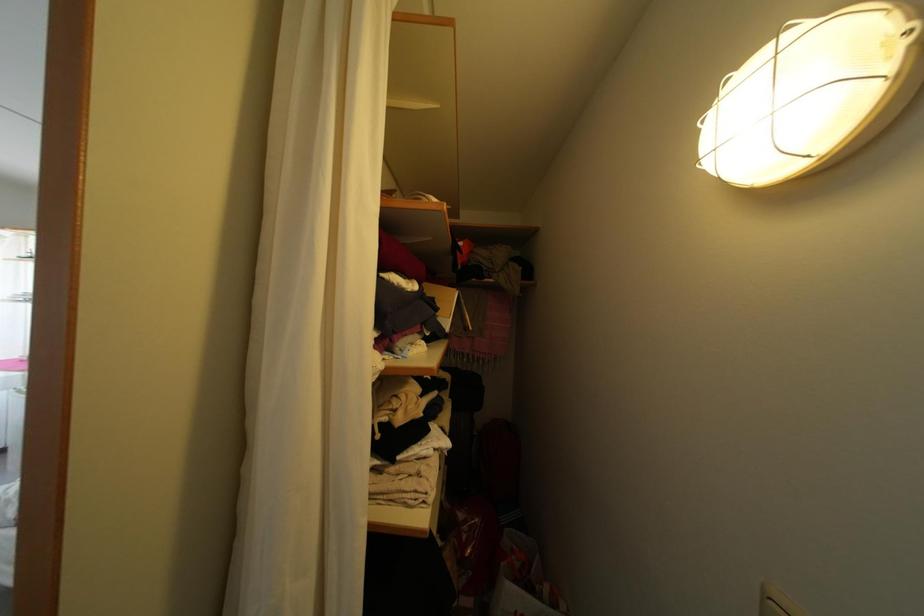
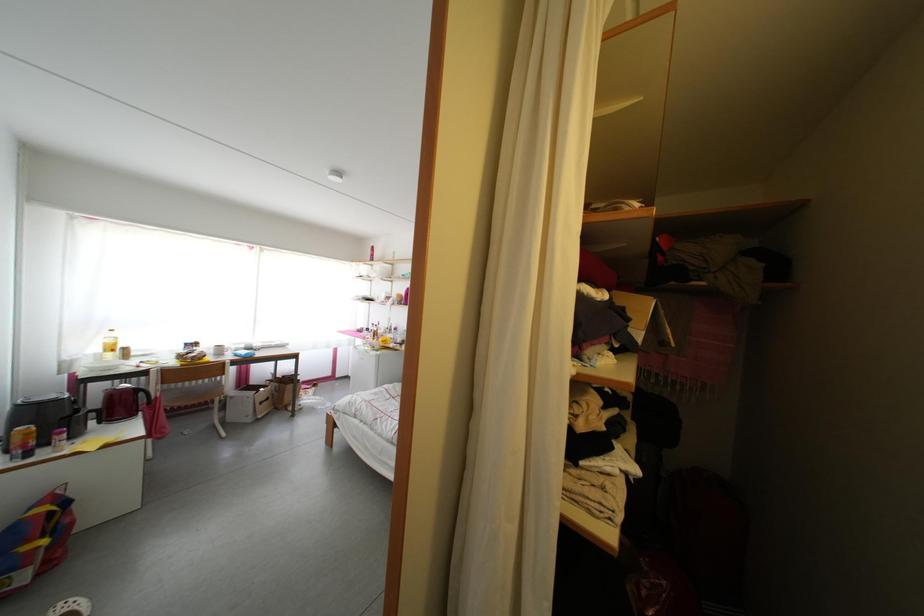
Question: How did the camera likely rotate?

Choices:
 (A) Left
 (B) Right
 (C) Up
 (D) Down

Answer: (A)